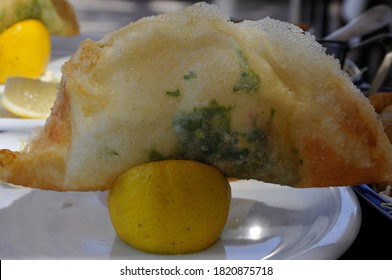
Find the location of a particular element. This screenshot has width=392, height=280. rim of plate is located at coordinates (353, 224).